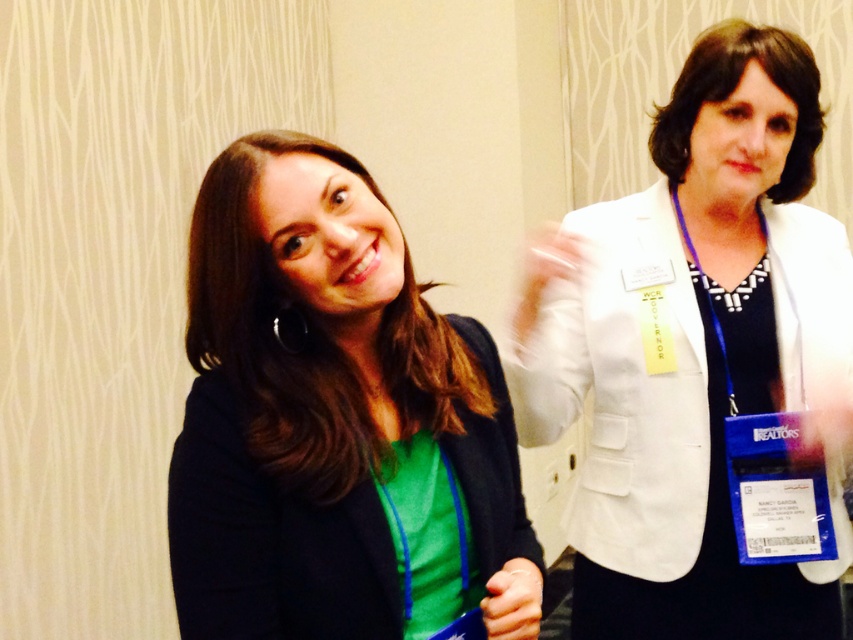
You are an artist trying to sketch this scene. You notice the white matte blazer at upper right and the translucent plastic hand at upper center. Which object should you draw first to ensure proper layering?

You should draw the white matte blazer at upper right first because the translucent plastic hand at upper center is behind it, so the hand needs to be layered over the blazer in the sketch.

You are standing in front of the two women and want to take a photo of the point at coordinates point (287, 513). Can you estimate how far you need to move forward or backward to focus on that point?

The point at coordinates point (287, 513) is 1.04 meters away from the camera. To focus on that point, you should adjust your distance to be exactly 1.04 meters away from the point.